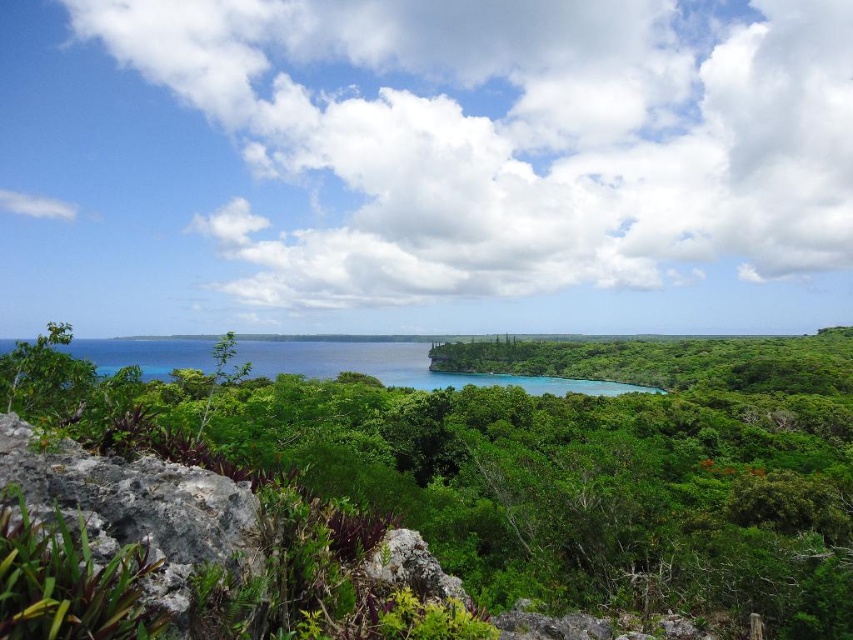
You are standing at the point marked by point (595, 470) in the tropical landscape. Looking around, what is the most prominent feature directly in front of you?

The most prominent feature directly in front of you is the green leafy tree at center marked by point (595, 470).

You are standing at the origin point of the image. Which direction should you move to reach the green leafy tree at center?

The green leafy tree at center is located at coordinate point 0.736 on the x axis and 0.698 on the y axis, so you should move towards the right and slightly upwards to reach it.